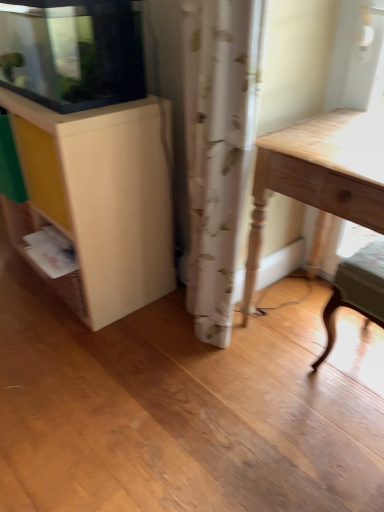
Where is `vacant space that is to the left of light wood table at right`? vacant space that is to the left of light wood table at right is located at coordinates (197, 382).